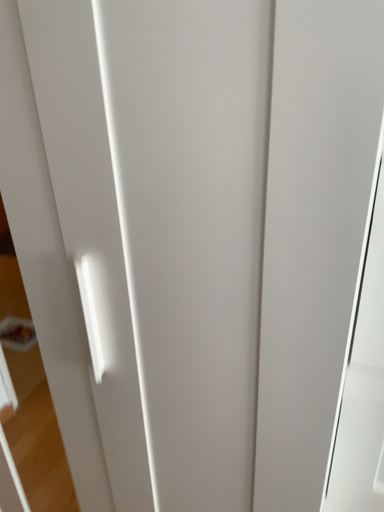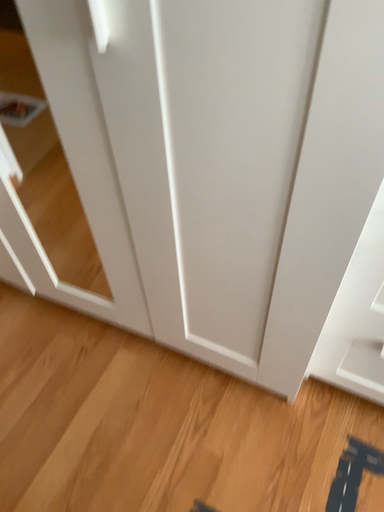
Question: How did the camera likely rotate when shooting the video?

Choices:
 (A) rotated upward
 (B) rotated downward

Answer: (B)